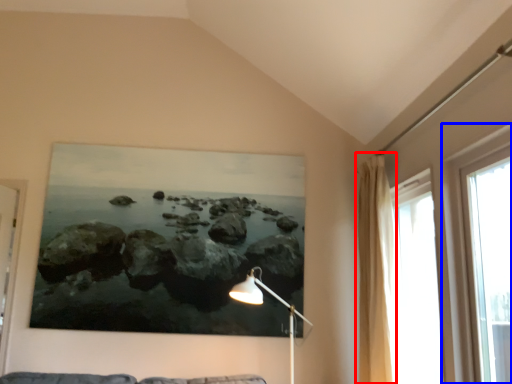
Question: Which object is further to the camera taking this photo, curtain (highlighted by a red box) or window (highlighted by a blue box)?

Choices:
 (A) curtain
 (B) window

Answer: (A)